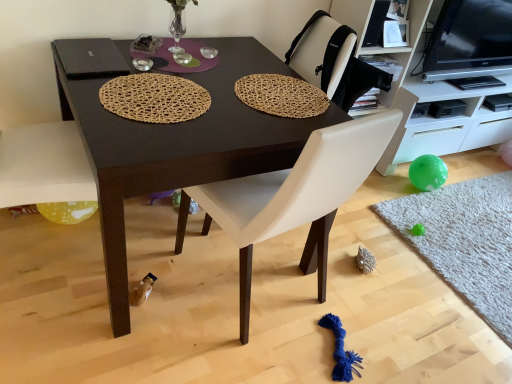
Identify the location of free space that is in between white leather chair at center and gray shaggy rug at lower right, which appears as the first mat when ordered from the bottom. (387, 284).